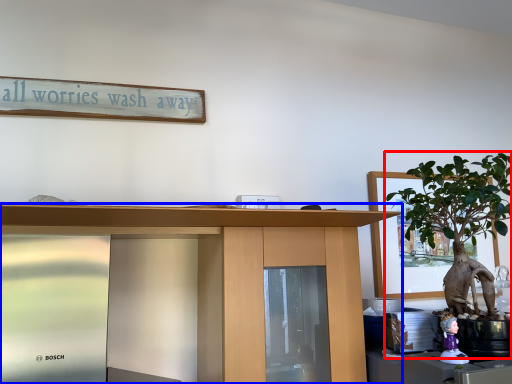
Question: Which of the following is the farthest to the observer, houseplant (highlighted by a red box) or desk (highlighted by a blue box)?

Choices:
 (A) houseplant
 (B) desk

Answer: (A)